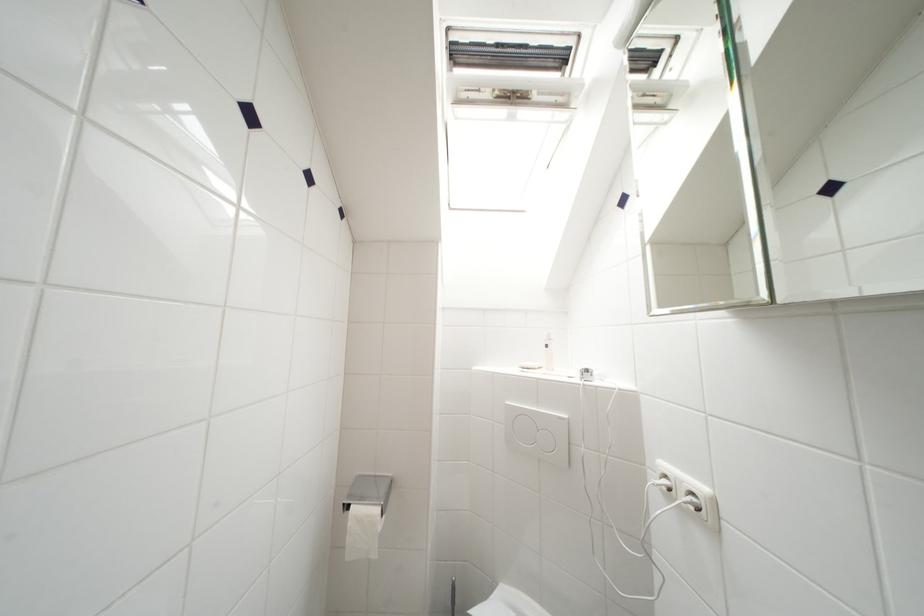
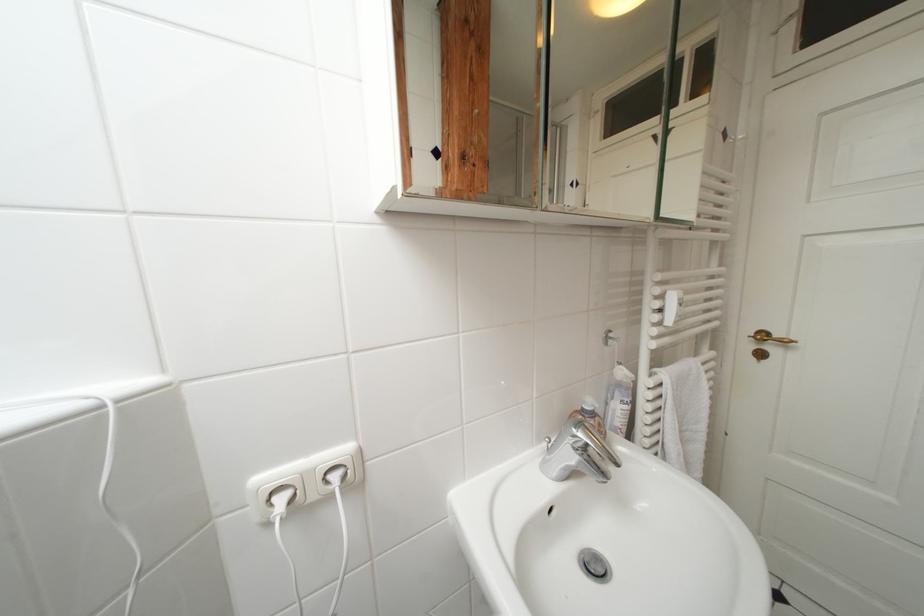
Question: The images are taken continuously from a first-person perspective. In which direction is your viewpoint rotating?

Choices:
 (A) Left
 (B) Right
 (C) Up
 (D) Down

Answer: (B)